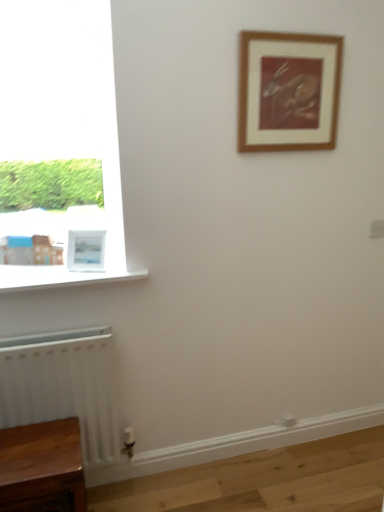
Question: Which direction should I rotate to look at wooden framed print at upper center, acting as the first picture frame starting from the top, — up or down?

Choices:
 (A) up
 (B) down

Answer: (A)

Question: Could white matte radiator at lower left be considered to be inside wooden table at lower left?

Choices:
 (A) no
 (B) yes

Answer: (A)

Question: Is wooden table at lower left bigger than white matte radiator at lower left?

Choices:
 (A) no
 (B) yes

Answer: (A)

Question: From a real-world perspective, is wooden table at lower left below white matte radiator at lower left?

Choices:
 (A) yes
 (B) no

Answer: (A)

Question: Can you confirm if wooden table at lower left is smaller than white matte radiator at lower left?

Choices:
 (A) no
 (B) yes

Answer: (B)

Question: Is wooden table at lower left positioned far away from white matte radiator at lower left?

Choices:
 (A) no
 (B) yes

Answer: (A)

Question: Is wooden table at lower left shorter than white matte radiator at lower left?

Choices:
 (A) no
 (B) yes

Answer: (B)

Question: From the image's perspective, would you say white glossy window sill at lower left is positioned over wooden framed print at upper center, arranged as the 2th picture frame when viewed from the left?

Choices:
 (A) yes
 (B) no

Answer: (B)

Question: From a real-world perspective, does white glossy window sill at lower left stand above wooden framed print at upper center, acting as the 2th picture frame starting from the bottom?

Choices:
 (A) yes
 (B) no

Answer: (B)

Question: Considering the relative sizes of white glossy window sill at lower left and wooden framed print at upper center, acting as the 2th picture frame starting from the bottom, in the image provided, is white glossy window sill at lower left wider than wooden framed print at upper center, acting as the 2th picture frame starting from the bottom,?

Choices:
 (A) yes
 (B) no

Answer: (A)

Question: Is white glossy window sill at lower left looking in the opposite direction of wooden framed print at upper center, acting as the 2th picture frame starting from the bottom?

Choices:
 (A) no
 (B) yes

Answer: (A)

Question: Is white glossy window sill at lower left taller than wooden framed print at upper center, acting as the first picture frame starting from the top?

Choices:
 (A) no
 (B) yes

Answer: (A)

Question: Is white glossy window sill at lower left behind wooden framed print at upper center, acting as the 2th picture frame starting from the bottom?

Choices:
 (A) no
 (B) yes

Answer: (A)

Question: Is white matte radiator at lower left further to camera compared to white glossy window sill at lower left?

Choices:
 (A) no
 (B) yes

Answer: (A)